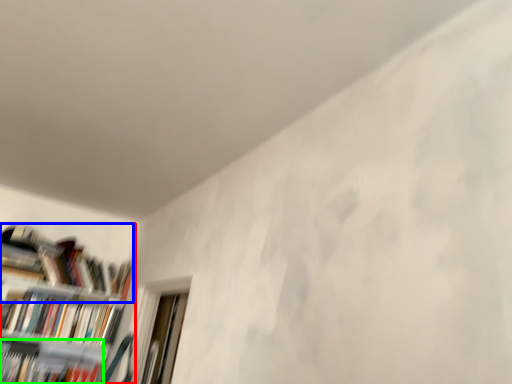
Question: Which object is the farthest from bookcase (highlighted by a red box)? Choose among these: book (highlighted by a blue box) or book (highlighted by a green box).

Choices:
 (A) book
 (B) book

Answer: (B)